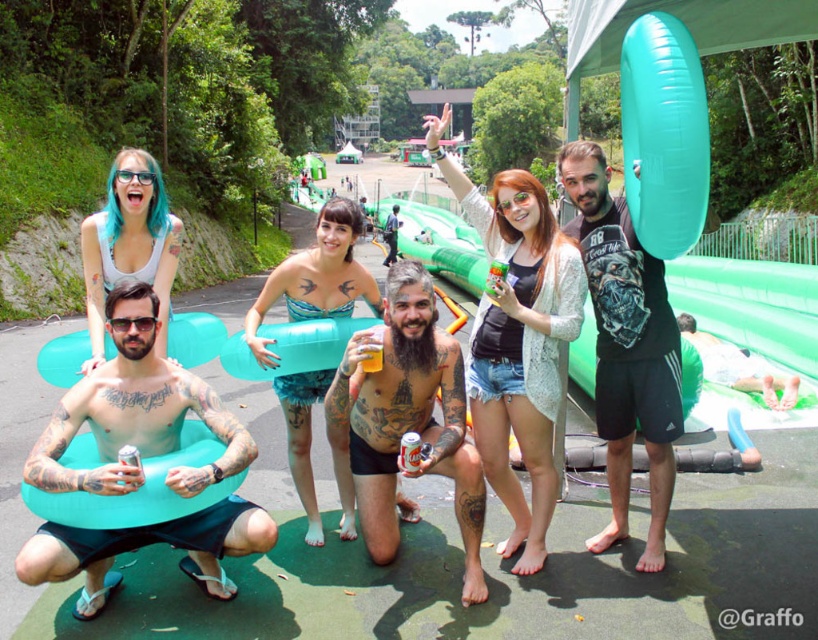
You are a photographer trying to capture a closeup of the blue rubber ring at center. However, the tattooed skin at lower left is blocking your view. Can you adjust your camera angle to avoid the obstruction?

The tattooed skin at lower left is in front of the blue rubber ring at center, so you can move your camera angle slightly upward or to the right to avoid the obstruction and focus on the blue rubber ring at center.